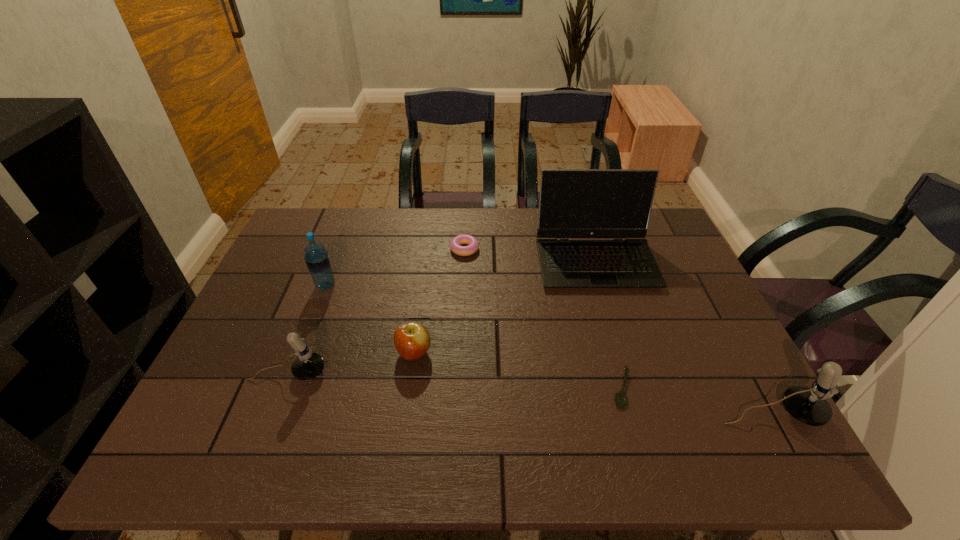
To make them evenly spaced by inserting another microphone among them, please locate a free space for this new microphone. Please provide its 2D coordinates. Your answer should be formatted as a tuple, i.e. [(x, y)], where the tuple contains the x and y coordinates of a point satisfying the conditions above.

[(519, 392)]